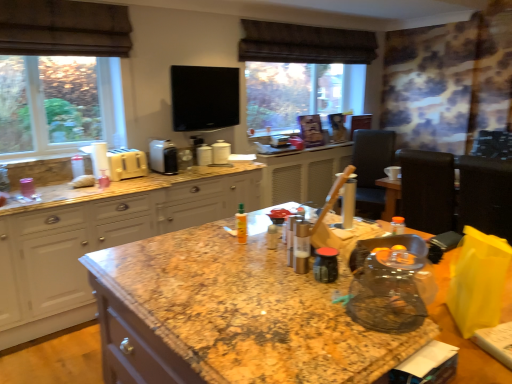
Question: Which direction should I rotate to face white glossy canister at center, marked as the 4th appliance in a left-to-right arrangement, — up or down?

Choices:
 (A) down
 (B) up

Answer: (B)

Question: From a real-world perspective, is white plastic toaster at center, which is the 3th appliance from right to left, located beneath granite at center?

Choices:
 (A) yes
 (B) no

Answer: (B)

Question: Is white plastic toaster at center, which is the 3th appliance from right to left, not near granite at center?

Choices:
 (A) no
 (B) yes

Answer: (B)

Question: From the image's perspective, is white plastic toaster at center, marked as the 2th appliance in a left-to-right arrangement, below granite at center?

Choices:
 (A) yes
 (B) no

Answer: (B)

Question: Is white plastic toaster at center, marked as the 2th appliance in a left-to-right arrangement, oriented away from granite at center?

Choices:
 (A) no
 (B) yes

Answer: (A)

Question: Can you confirm if white plastic toaster at center, which is the 3th appliance from right to left, is taller than granite at center?

Choices:
 (A) no
 (B) yes

Answer: (A)

Question: Is white plastic toaster at center, which is the 3th appliance from right to left, to the right of granite at center from the viewer's perspective?

Choices:
 (A) no
 (B) yes

Answer: (A)

Question: Would you say dark brown leather chair at right, placed as the 1th chair when sorted from back to front, is outside yellow plastic toaster at left, the first appliance viewed from the left?

Choices:
 (A) no
 (B) yes

Answer: (B)

Question: Considering the relative sizes of dark brown leather chair at right, which is the 2th chair from front to back, and yellow plastic toaster at left, the first appliance viewed from the left, in the image provided, is dark brown leather chair at right, which is the 2th chair from front to back, thinner than yellow plastic toaster at left, the first appliance viewed from the left,?

Choices:
 (A) no
 (B) yes

Answer: (A)

Question: Is dark brown leather chair at right, which is the 2th chair from front to back, not close to yellow plastic toaster at left, the first appliance viewed from the left?

Choices:
 (A) no
 (B) yes

Answer: (B)

Question: Does dark brown leather chair at right, placed as the 1th chair when sorted from back to front, lie in front of yellow plastic toaster at left, the first appliance viewed from the left?

Choices:
 (A) no
 (B) yes

Answer: (A)

Question: Considering the relative sizes of dark brown leather chair at right, placed as the 1th chair when sorted from back to front, and yellow plastic toaster at left, which is the 4th appliance in right-to-left order, in the image provided, is dark brown leather chair at right, placed as the 1th chair when sorted from back to front, smaller than yellow plastic toaster at left, which is the 4th appliance in right-to-left order,?

Choices:
 (A) no
 (B) yes

Answer: (A)

Question: Are dark brown leather chair at right, which is the 2th chair from front to back, and yellow plastic toaster at left, which is the 4th appliance in right-to-left order, making contact?

Choices:
 (A) no
 (B) yes

Answer: (A)

Question: Can you confirm if white glossy canister at center, marked as the 4th appliance in a left-to-right arrangement, is bigger than granite at center?

Choices:
 (A) no
 (B) yes

Answer: (A)